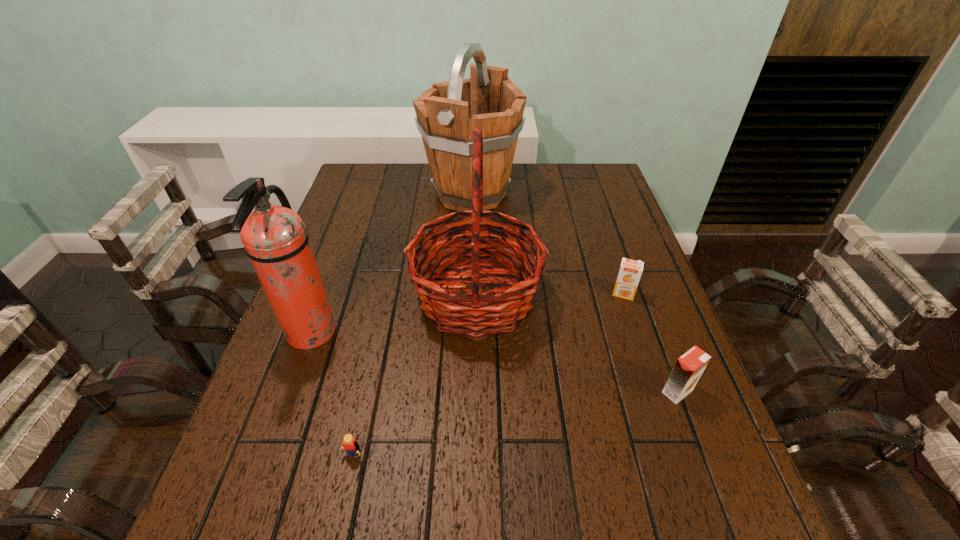
Locate an element on the screen. The height and width of the screenshot is (540, 960). empty space that is in between the fire extinguisher and the basket is located at coordinates (394, 315).

Image resolution: width=960 pixels, height=540 pixels. Identify the location of vacant area that lies between the fire extinguisher and the farthest object. (391, 264).

Find the location of `free space between the second object from left to right and the farther orange juice`. free space between the second object from left to right and the farther orange juice is located at coordinates [488, 378].

In order to click on empty space between the second nearest object and the farther orange juice in this screenshot , I will do `click(650, 342)`.

Locate an element on the screen. free space between the bucket and the fifth farthest object is located at coordinates (574, 293).

Locate an element on the screen. The height and width of the screenshot is (540, 960). free spot between the fifth farthest object and the basket is located at coordinates (577, 345).

The width and height of the screenshot is (960, 540). I want to click on empty location between the basket and the second object from left to right, so click(x=415, y=380).

Locate which object ranks second in proximity to the nearer orange juice. Please provide its 2D coordinates. Your answer should be formatted as a tuple, i.e. [(x, y)], where the tuple contains the x and y coordinates of a point satisfying the conditions above.

[(473, 315)]

Identify which object is the closest to the bucket. Please provide its 2D coordinates. Your answer should be formatted as a tuple, i.e. [(x, y)], where the tuple contains the x and y coordinates of a point satisfying the conditions above.

[(473, 315)]

Locate an element on the screen. Image resolution: width=960 pixels, height=540 pixels. free space that satisfies the following two spatial constraints: 1. at the nozzle of the fifth farthest object; 2. on the left side of the fire extinguisher is located at coordinates point(289,392).